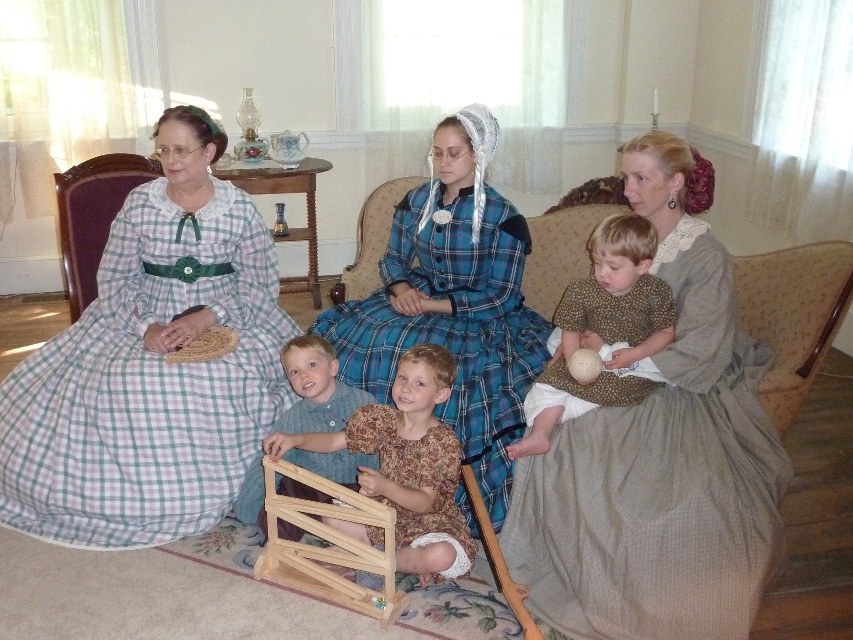
Question: Is wooden toy at center positioned in front of beige fabric armchair at lower right?

Choices:
 (A) yes
 (B) no

Answer: (A)

Question: Considering the real-world distances, which object is closest to the plaid cotton dress at left?

Choices:
 (A) blue plaid fabric dress at center
 (B) matte gray dress at right

Answer: (A)

Question: Can you confirm if wooden toy at center is wider than beige fabric armchair at lower right?

Choices:
 (A) no
 (B) yes

Answer: (B)

Question: Among these objects, which one is nearest to the camera?

Choices:
 (A) beige fabric armchair at lower right
 (B) blue plaid fabric dress at center

Answer: (A)

Question: Which of the following is the farthest from the observer?

Choices:
 (A) (77, 292)
 (B) (622, 349)

Answer: (A)

Question: Can you confirm if blue plaid fabric dress at center is positioned to the right of wooden toy at center?

Choices:
 (A) yes
 (B) no

Answer: (A)